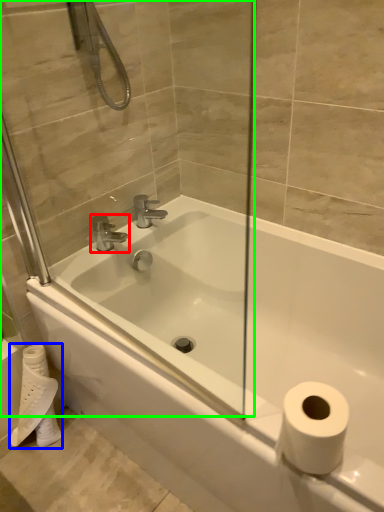
Question: Which object is the closest to the tap (highlighted by a red box)? Choose among these: toilet paper (highlighted by a blue box) or glass door (highlighted by a green box).

Choices:
 (A) toilet paper
 (B) glass door

Answer: (B)